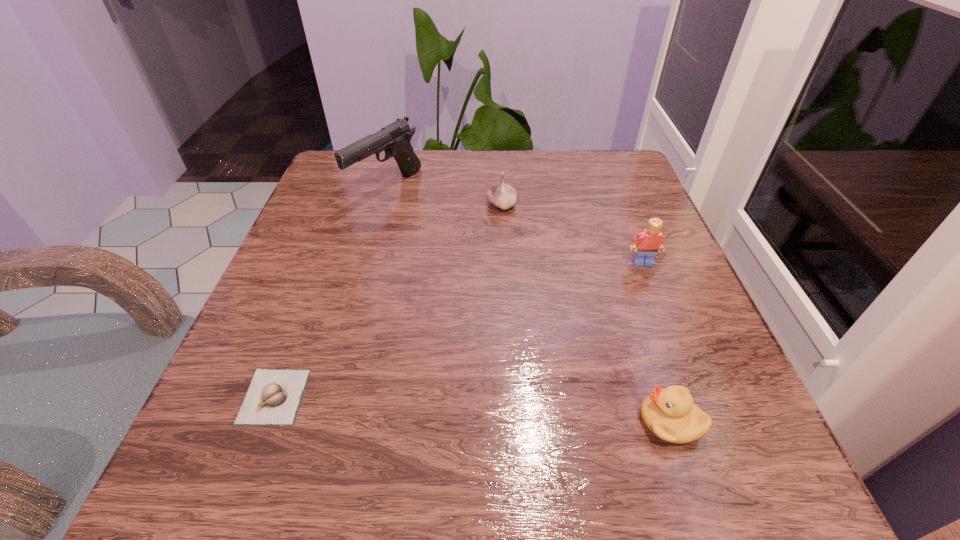
Image resolution: width=960 pixels, height=540 pixels. Identify the location of vacant area located on the left of the right garlic. (336, 205).

Identify the location of free space located on the beak of the second shortest object. (427, 421).

You are a GUI agent. You are given a task and a screenshot of the screen. Output one action in this format:
    pyautogui.click(x=<x>, y=<y>)
    Task: Click on the vacant space located 0.110m on the beak of the second shortest object
    
    Given the screenshot: What is the action you would take?
    pyautogui.click(x=560, y=421)

At what (x,y) coordinates should I click in order to perform the action: click on blank space located 0.190m on the beak of the second shortest object. Please return your answer as a coordinate pair (x, y). The image size is (960, 540). Looking at the image, I should click on (501, 421).

You are a GUI agent. You are given a task and a screenshot of the screen. Output one action in this format:
    pyautogui.click(x=<x>, y=<y>)
    Task: Click on the free spot located 0.050m on the back of the shortest object
    The height and width of the screenshot is (540, 960).
    Given the screenshot: What is the action you would take?
    pyautogui.click(x=295, y=342)

Find the location of a particular element. The height and width of the screenshot is (540, 960). gun at the far edge is located at coordinates (394, 139).

The image size is (960, 540). What are the coordinates of `garlic that is at the far edge` in the screenshot? It's located at (502, 195).

The height and width of the screenshot is (540, 960). What are the coordinates of `object present at the near edge` in the screenshot? It's located at (670, 414).

Find the location of a particular element. gun at the left edge is located at coordinates (394, 139).

The width and height of the screenshot is (960, 540). I want to click on garlic that is positioned at the left edge, so (x=273, y=398).